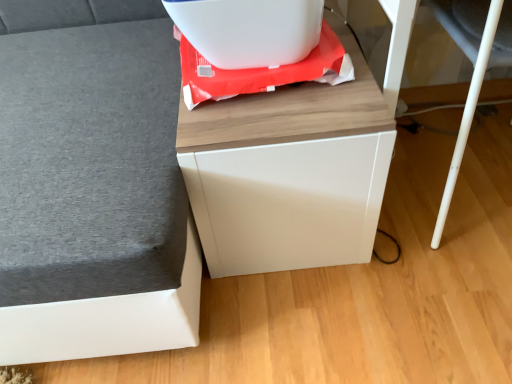
Identify the location of unoccupied area in front of white glossy cabinet at center, arranged as the first furniture when viewed from the right. (323, 319).